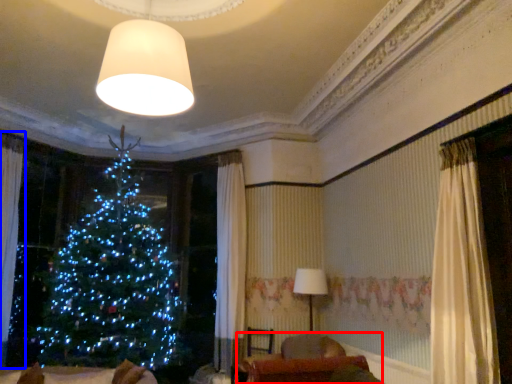
Question: Which object is further to the camera taking this photo, furniture (highlighted by a red box) or curtain (highlighted by a blue box)?

Choices:
 (A) furniture
 (B) curtain

Answer: (B)